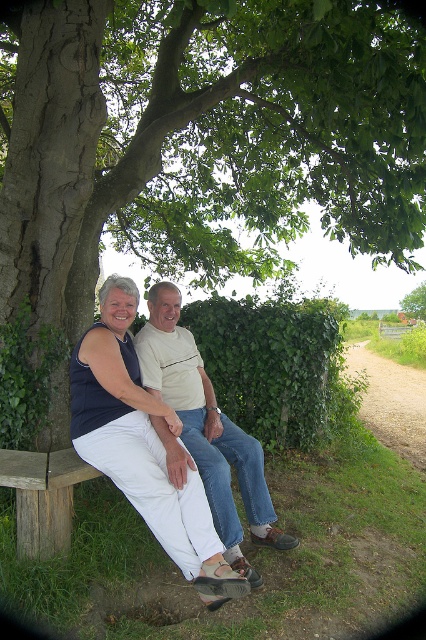
Question: Is green leafy tree at left thinner than brown wooden bench at lower left?

Choices:
 (A) yes
 (B) no

Answer: (A)

Question: Is green leafy tree at left in front of matte blue tank top at center?

Choices:
 (A) no
 (B) yes

Answer: (A)

Question: Estimate the real-world distances between objects in this image. Which object is closer to the brown wooden bench at lower left?

Choices:
 (A) green leafy hedge at center
 (B) light beige cotton shirt at center

Answer: (B)

Question: Based on their relative distances, which object is farther from the green leafy tree at left?

Choices:
 (A) matte blue tank top at center
 (B) brown wooden bench at lower left

Answer: (B)

Question: Which object is positioned farthest from the green leafy tree at upper center?

Choices:
 (A) brown wooden bench at lower left
 (B) green leafy hedge at center
 (C) matte blue tank top at center
 (D) green leafy tree at left

Answer: (A)

Question: Can you confirm if green leafy hedge at center is positioned to the left of light beige cotton shirt at center?

Choices:
 (A) yes
 (B) no

Answer: (B)